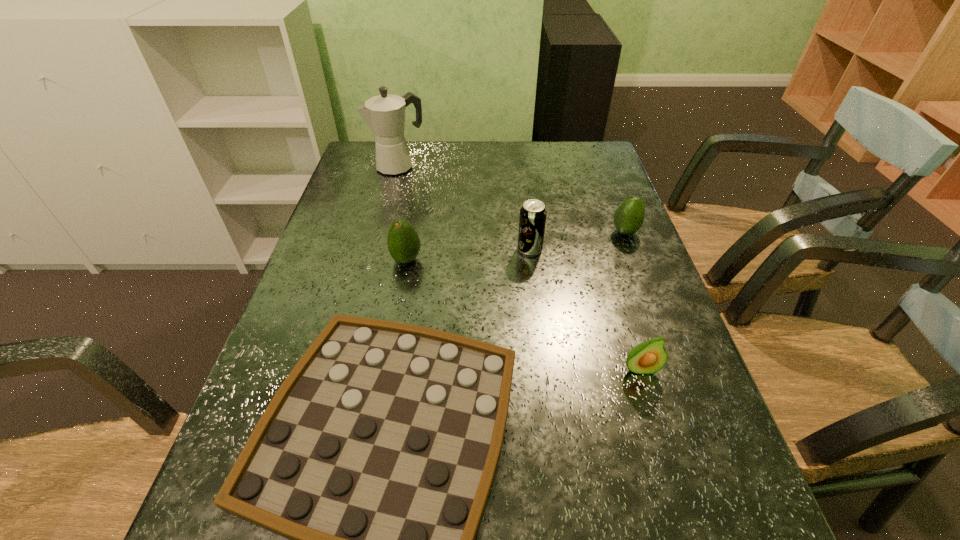
Locate an element on the screen. vacant point located between the fourth object from left to right and the second farthest avocado is located at coordinates (468, 255).

In order to click on free spot between the second farthest avocado and the soda can in this screenshot , I will do `click(468, 255)`.

Identify the location of free space between the nearest avocado and the tallest object. pos(519,268).

Where is `vacant point located between the nearest avocado and the farthest avocado`? This screenshot has height=540, width=960. vacant point located between the nearest avocado and the farthest avocado is located at coordinates (633, 300).

Locate an element on the screen. vacant area that lies between the nearest avocado and the third object from right to left is located at coordinates (585, 309).

Image resolution: width=960 pixels, height=540 pixels. What are the coordinates of `free space that is in between the soda can and the farthest avocado` in the screenshot? It's located at (577, 241).

Locate an element on the screen. Image resolution: width=960 pixels, height=540 pixels. vacant point located between the soda can and the tallest object is located at coordinates (464, 208).

The image size is (960, 540). I want to click on vacant point located between the nearest avocado and the leftmost avocado, so click(x=523, y=314).

Identify the location of object that is the fourth closest one to the leftmost avocado. This screenshot has height=540, width=960. (648, 357).

What are the coordinates of `object that stands as the second closest to the checkerboard` in the screenshot? It's located at (648, 357).